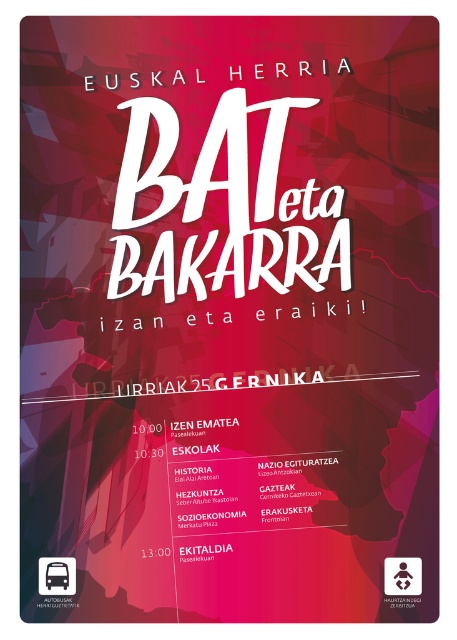
Question: Which object appears farthest from the camera in this image?

Choices:
 (A) matte red square at center
 (B) white digital clock at center
 (C) brushed metal bus at lower left

Answer: (B)

Question: From the image, what is the correct spatial relationship of matte red square at center in relation to red matte text at center?

Choices:
 (A) right
 (B) left

Answer: (A)

Question: Observing the image, what is the correct spatial positioning of matte red square at center in reference to red matte text at center?

Choices:
 (A) above
 (B) below

Answer: (B)

Question: Estimate the real-world distances between objects in this image. Which object is closer to the red matte text at center?

Choices:
 (A) white digital clock at center
 (B) brushed metal bus at lower left
 (C) matte red square at center

Answer: (A)

Question: Estimate the real-world distances between objects in this image. Which object is farther from the brushed metal bus at lower left?

Choices:
 (A) white digital clock at center
 (B) red matte text at center

Answer: (B)

Question: Does matte red square at center appear on the left side of white digital clock at center?

Choices:
 (A) no
 (B) yes

Answer: (A)